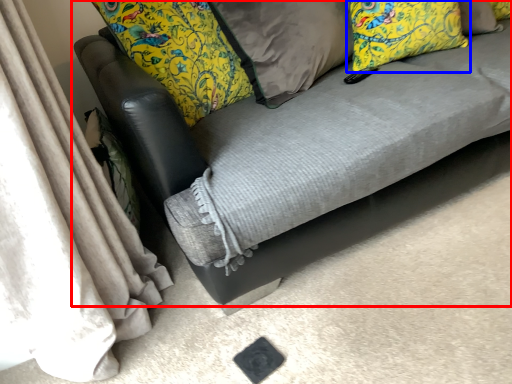
Question: Among these objects, which one is nearest to the camera, studio couch (highlighted by a red box) or pillow (highlighted by a blue box)?

Choices:
 (A) studio couch
 (B) pillow

Answer: (A)